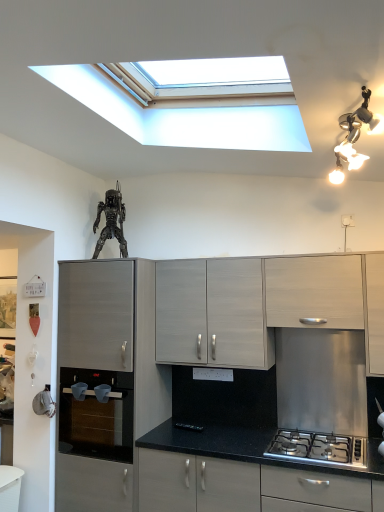
Question: Is silver metallic light fixture at upper right smaller than matte black countertop at lower center, placed as the second cabinetry when sorted from right to left?

Choices:
 (A) no
 (B) yes

Answer: (B)

Question: Is silver metallic light fixture at upper right positioned with its back to matte black countertop at lower center, placed as the second cabinetry when sorted from right to left?

Choices:
 (A) yes
 (B) no

Answer: (B)

Question: Can you confirm if silver metallic light fixture at upper right is positioned to the left of matte black countertop at lower center, placed as the second cabinetry when sorted from right to left?

Choices:
 (A) no
 (B) yes

Answer: (A)

Question: Is silver metallic light fixture at upper right surrounding matte black countertop at lower center, placed as the second cabinetry when sorted from right to left?

Choices:
 (A) yes
 (B) no

Answer: (B)

Question: Can you confirm if silver metallic light fixture at upper right is positioned to the right of matte black countertop at lower center, the 3th cabinetry from the left?

Choices:
 (A) yes
 (B) no

Answer: (A)

Question: From a real-world perspective, is silver metallic light fixture at upper right over matte black countertop at lower center, the 3th cabinetry from the left?

Choices:
 (A) yes
 (B) no

Answer: (A)

Question: Is satin silver gas stove at lower right positioned with its back to metallic silver figure at upper center?

Choices:
 (A) no
 (B) yes

Answer: (A)

Question: From a real-world perspective, is satin silver gas stove at lower right below metallic silver figure at upper center?

Choices:
 (A) no
 (B) yes

Answer: (B)

Question: Is satin silver gas stove at lower right to the right of metallic silver figure at upper center from the viewer's perspective?

Choices:
 (A) no
 (B) yes

Answer: (B)

Question: Is satin silver gas stove at lower right further to the viewer compared to metallic silver figure at upper center?

Choices:
 (A) yes
 (B) no

Answer: (B)

Question: Considering the relative sizes of satin silver gas stove at lower right and metallic silver figure at upper center in the image provided, is satin silver gas stove at lower right wider than metallic silver figure at upper center?

Choices:
 (A) yes
 (B) no

Answer: (A)

Question: Is satin silver gas stove at lower right to the left of metallic silver figure at upper center from the viewer's perspective?

Choices:
 (A) no
 (B) yes

Answer: (A)

Question: Does matte gray cabinet at left, arranged as the 4th cabinetry when viewed from the right, turn towards black glass oven at lower left?

Choices:
 (A) yes
 (B) no

Answer: (A)